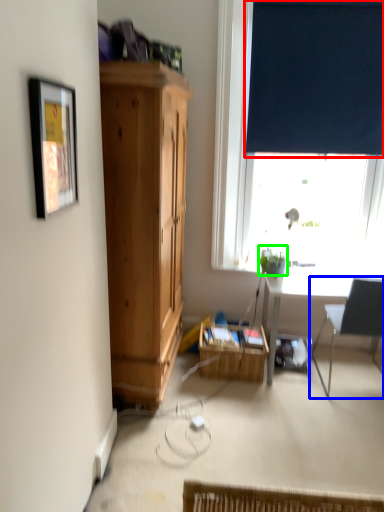
Question: Which object is the farthest from curtain (highlighted by a red box)? Choose among these: chair (highlighted by a blue box) or plant (highlighted by a green box).

Choices:
 (A) chair
 (B) plant

Answer: (A)